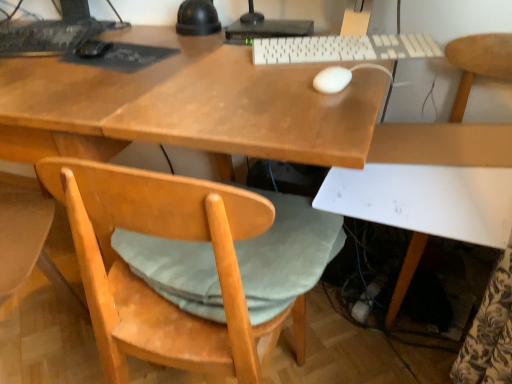
Where is `vacant area that is in front of white matte mouse at center, which is the 2th mouse from back to front`? vacant area that is in front of white matte mouse at center, which is the 2th mouse from back to front is located at coordinates (321, 110).